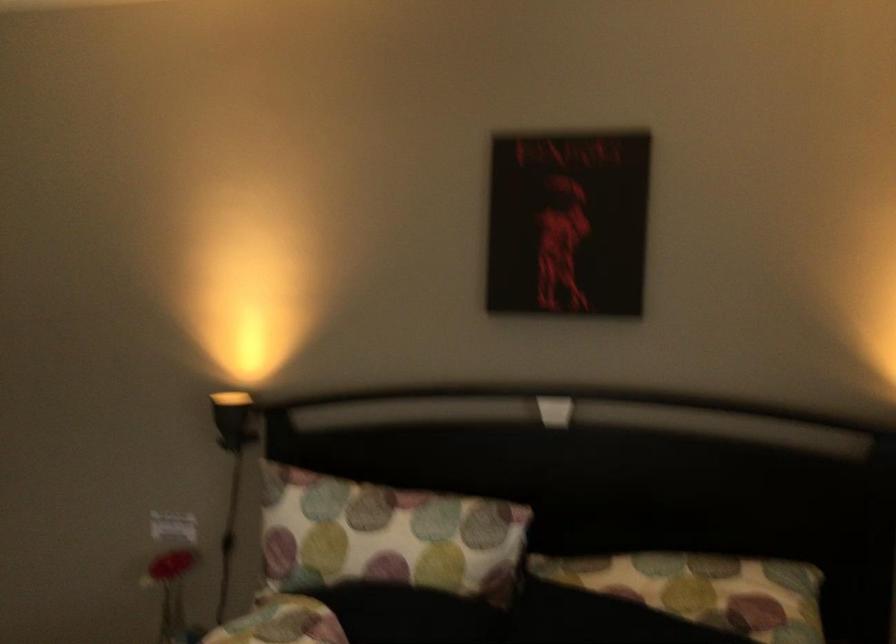
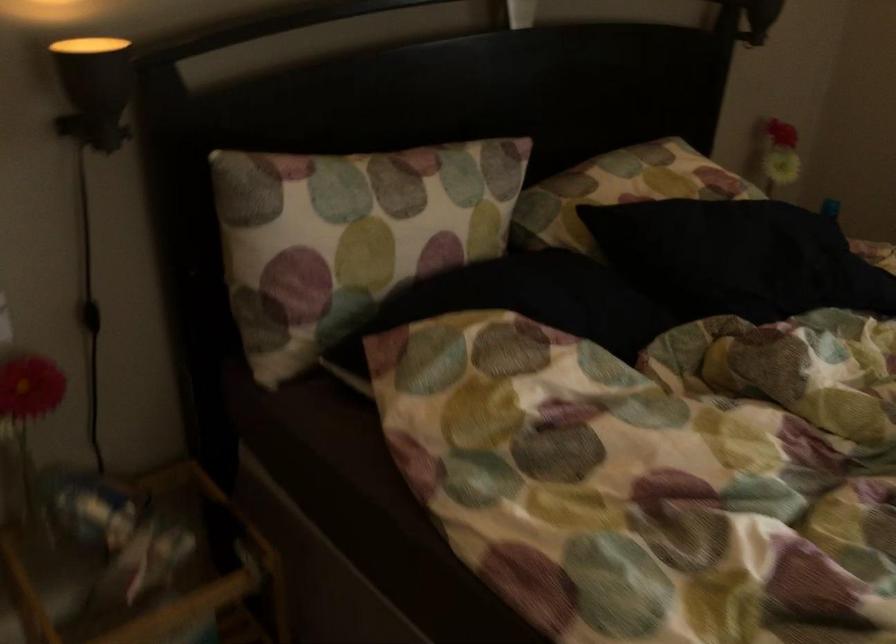
In the second image, find the point that corresponds to [340,515] in the first image.

(367, 207)